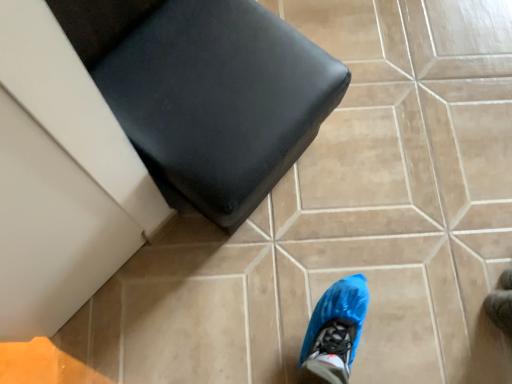
Image resolution: width=512 pixels, height=384 pixels. What are the coordinates of `vacant space to the right of black leather chair at upper left` in the screenshot? It's located at (371, 170).